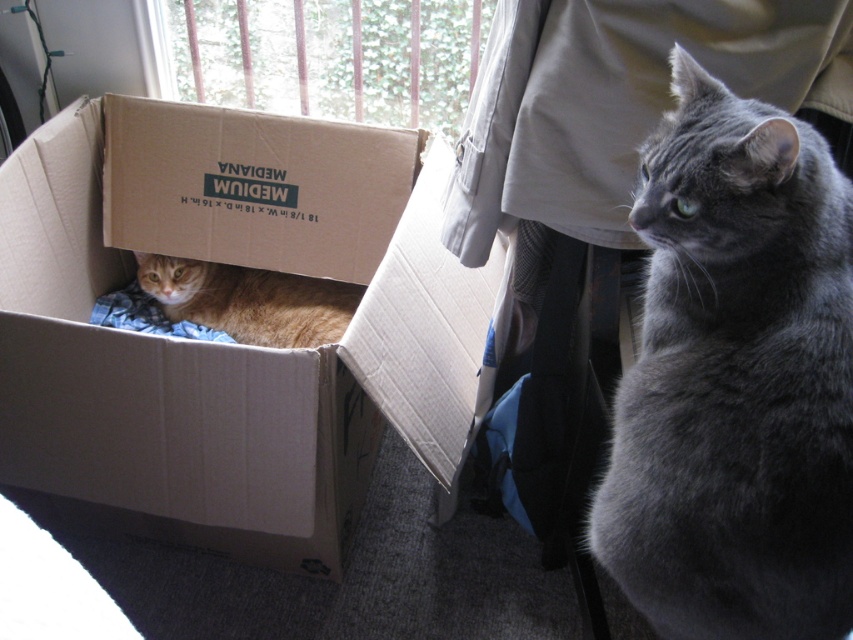
You are a cat owner who wants to place a new toy between the gray fluffy cat at center and the orange tabby cat at left. Based on their positions, where should you place the toy so it is between them?

The gray fluffy cat at center is located below the orange tabby cat at left, so placing the toy between them would require positioning it in the middle area between their vertical positions.

You are a cat owner trying to decide which cat to feed first. Based on their sizes, which cat might need more food? Please refer to the gray fluffy cat at center and the orange tabby cat at left in the image.

The orange tabby cat at left is thicker than the gray fluffy cat at center, so the orange tabby cat at left might need more food since it has a larger body size.